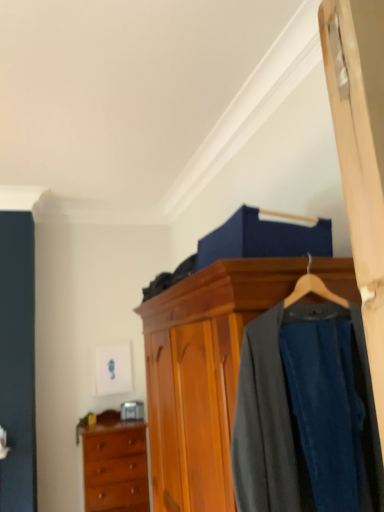
Question: Should I look upward or downward to see wooden chest of drawers at lower left?

Choices:
 (A) down
 (B) up

Answer: (A)

Question: Does dark gray wool suit at center appear on the left side of wooden chest of drawers at lower left?

Choices:
 (A) yes
 (B) no

Answer: (B)

Question: Considering the relative sizes of dark gray wool suit at center and wooden chest of drawers at lower left in the image provided, is dark gray wool suit at center smaller than wooden chest of drawers at lower left?

Choices:
 (A) yes
 (B) no

Answer: (A)

Question: Considering the relative positions of dark gray wool suit at center and wooden chest of drawers at lower left in the image provided, is dark gray wool suit at center to the right of wooden chest of drawers at lower left from the viewer's perspective?

Choices:
 (A) no
 (B) yes

Answer: (B)

Question: Is dark gray wool suit at center oriented away from wooden chest of drawers at lower left?

Choices:
 (A) yes
 (B) no

Answer: (A)

Question: Can you confirm if dark gray wool suit at center is thinner than wooden chest of drawers at lower left?

Choices:
 (A) yes
 (B) no

Answer: (A)

Question: Is dark gray wool suit at center outside wooden chest of drawers at lower left?

Choices:
 (A) yes
 (B) no

Answer: (A)

Question: Does wooden wardrobe at center have a larger size compared to wooden chest of drawers at lower left?

Choices:
 (A) yes
 (B) no

Answer: (A)

Question: From the image's perspective, would you say wooden wardrobe at center is shown under wooden chest of drawers at lower left?

Choices:
 (A) no
 (B) yes

Answer: (A)

Question: Is wooden wardrobe at center outside wooden chest of drawers at lower left?

Choices:
 (A) yes
 (B) no

Answer: (A)

Question: Does wooden wardrobe at center appear on the left side of wooden chest of drawers at lower left?

Choices:
 (A) no
 (B) yes

Answer: (A)

Question: From the image's perspective, is wooden wardrobe at center located above wooden chest of drawers at lower left?

Choices:
 (A) yes
 (B) no

Answer: (A)

Question: From a real-world perspective, is wooden wardrobe at center located beneath wooden chest of drawers at lower left?

Choices:
 (A) yes
 (B) no

Answer: (B)

Question: From a real-world perspective, is wooden wardrobe at center on top of dark gray wool suit at center?

Choices:
 (A) yes
 (B) no

Answer: (B)